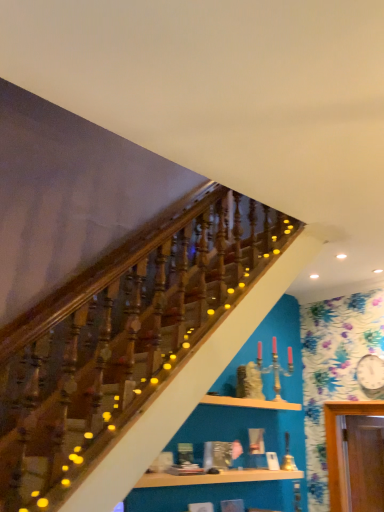
You are a GUI agent. You are given a task and a screenshot of the screen. Output one action in this format:
    pyautogui.click(x=<x>, y=<y>)
    Task: Click on the wooden shelf at lower center, which is the second shelf in top-to-bottom order
    
    Given the screenshot: What is the action you would take?
    pyautogui.click(x=215, y=477)

This screenshot has width=384, height=512. What do you see at coordinates (215, 477) in the screenshot?
I see `wooden shelf at lower center, which is the second shelf in top-to-bottom order` at bounding box center [215, 477].

The image size is (384, 512). What do you see at coordinates (250, 403) in the screenshot?
I see `wooden shelf at center, acting as the 2th shelf starting from the bottom` at bounding box center [250, 403].

You are a GUI agent. You are given a task and a screenshot of the screen. Output one action in this format:
    pyautogui.click(x=<x>, y=<y>)
    Task: Click on the wooden shelf at center, acting as the 2th shelf starting from the bottom
    Image resolution: width=384 pixels, height=512 pixels.
    Given the screenshot: What is the action you would take?
    pyautogui.click(x=250, y=403)

Based on the photo, in order to face wooden shelf at center, which ranks as the 1th shelf in top-to-bottom order, should I rotate leftwards or rightwards?

A 7.129 degree turn to the right will do.

Identify the location of wooden shelf at lower center, which is the second shelf in top-to-bottom order. (215, 477).

Looking at this image, which object is positioned more to the left, wooden shelf at center, acting as the 2th shelf starting from the bottom, or wooden shelf at lower center, which is the second shelf in top-to-bottom order?

From the viewer's perspective, wooden shelf at lower center, which is the second shelf in top-to-bottom order, appears more on the left side.

Based on the photo, in the image, is wooden shelf at center, which ranks as the 1th shelf in top-to-bottom order, positioned in front of or behind wooden shelf at lower center, acting as the 1th shelf starting from the bottom?

wooden shelf at center, which ranks as the 1th shelf in top-to-bottom order, is positioned farther from the viewer than wooden shelf at lower center, acting as the 1th shelf starting from the bottom.

Between point (281, 405) and point (170, 480), which one is positioned in front?

The point (170, 480) is closer.

From the image's perspective, is wooden shelf at center, acting as the 2th shelf starting from the bottom, located beneath wooden shelf at lower center, acting as the 1th shelf starting from the bottom?

Incorrect, from the image's perspective, wooden shelf at center, acting as the 2th shelf starting from the bottom, is higher than wooden shelf at lower center, acting as the 1th shelf starting from the bottom.

From a real-world perspective, is wooden shelf at center, acting as the 2th shelf starting from the bottom, physically above wooden shelf at lower center, acting as the 1th shelf starting from the bottom?

Yes, from a real-world perspective, wooden shelf at center, acting as the 2th shelf starting from the bottom, is over wooden shelf at lower center, acting as the 1th shelf starting from the bottom

Which object is wider, wooden shelf at center, which ranks as the 1th shelf in top-to-bottom order, or wooden shelf at lower center, which is the second shelf in top-to-bottom order?

Wider between the two is wooden shelf at center, which ranks as the 1th shelf in top-to-bottom order.

Between wooden shelf at center, acting as the 2th shelf starting from the bottom, and wooden shelf at lower center, acting as the 1th shelf starting from the bottom, which one has less height?

With less height is wooden shelf at lower center, acting as the 1th shelf starting from the bottom.

Looking at the image, does wooden shelf at center, which ranks as the 1th shelf in top-to-bottom order, seem bigger or smaller compared to wooden shelf at lower center, which is the second shelf in top-to-bottom order?

wooden shelf at center, which ranks as the 1th shelf in top-to-bottom order, is smaller than wooden shelf at lower center, which is the second shelf in top-to-bottom order.

Is wooden shelf at lower center, which is the second shelf in top-to-bottom order, inside wooden shelf at center, acting as the 2th shelf starting from the bottom?

No, wooden shelf at lower center, which is the second shelf in top-to-bottom order, is not surrounded by wooden shelf at center, acting as the 2th shelf starting from the bottom.

Are wooden shelf at center, acting as the 2th shelf starting from the bottom, and wooden shelf at lower center, which is the second shelf in top-to-bottom order, making contact?

No, wooden shelf at center, acting as the 2th shelf starting from the bottom, is not making contact with wooden shelf at lower center, which is the second shelf in top-to-bottom order.

Is wooden shelf at center, acting as the 2th shelf starting from the bottom, positioned with its back to wooden shelf at lower center, acting as the 1th shelf starting from the bottom?

That's not correct — wooden shelf at center, acting as the 2th shelf starting from the bottom, is not looking away from wooden shelf at lower center, acting as the 1th shelf starting from the bottom.

Where is `shelf that is on the right side of wooden shelf at lower center, acting as the 1th shelf starting from the bottom`? shelf that is on the right side of wooden shelf at lower center, acting as the 1th shelf starting from the bottom is located at coordinates (250, 403).

Considering the positions of objects wooden shelf at lower center, which is the second shelf in top-to-bottom order, and wooden shelf at center, which ranks as the 1th shelf in top-to-bottom order, in the image provided, who is more to the right, wooden shelf at lower center, which is the second shelf in top-to-bottom order, or wooden shelf at center, which ranks as the 1th shelf in top-to-bottom order,?

From the viewer's perspective, wooden shelf at center, which ranks as the 1th shelf in top-to-bottom order, appears more on the right side.

Does wooden shelf at lower center, acting as the 1th shelf starting from the bottom, come in front of wooden shelf at center, which ranks as the 1th shelf in top-to-bottom order?

Yes, it is in front of wooden shelf at center, which ranks as the 1th shelf in top-to-bottom order.

Is point (244, 479) positioned in front of point (254, 399)?

Yes, it is.

Based on the photo, from the image's perspective, which one is positioned higher, wooden shelf at lower center, which is the second shelf in top-to-bottom order, or wooden shelf at center, acting as the 2th shelf starting from the bottom?

From the image's view, wooden shelf at center, acting as the 2th shelf starting from the bottom, is above.

From a real-world perspective, is wooden shelf at lower center, which is the second shelf in top-to-bottom order, above or below wooden shelf at center, acting as the 2th shelf starting from the bottom?

wooden shelf at lower center, which is the second shelf in top-to-bottom order, is situated lower than wooden shelf at center, acting as the 2th shelf starting from the bottom, in the real world.

Considering the relative sizes of wooden shelf at lower center, which is the second shelf in top-to-bottom order, and wooden shelf at center, acting as the 2th shelf starting from the bottom, in the image provided, is wooden shelf at lower center, which is the second shelf in top-to-bottom order, wider than wooden shelf at center, acting as the 2th shelf starting from the bottom,?

No.

Between wooden shelf at lower center, acting as the 1th shelf starting from the bottom, and wooden shelf at center, which ranks as the 1th shelf in top-to-bottom order, which one has more height?

With more height is wooden shelf at center, which ranks as the 1th shelf in top-to-bottom order.

Between wooden shelf at lower center, which is the second shelf in top-to-bottom order, and wooden shelf at center, which ranks as the 1th shelf in top-to-bottom order, which one has larger size?

wooden shelf at lower center, which is the second shelf in top-to-bottom order, is bigger.

Is wooden shelf at lower center, which is the second shelf in top-to-bottom order, outside of wooden shelf at center, acting as the 2th shelf starting from the bottom?

That's correct, wooden shelf at lower center, which is the second shelf in top-to-bottom order, is outside of wooden shelf at center, acting as the 2th shelf starting from the bottom.

Is wooden shelf at lower center, which is the second shelf in top-to-bottom order, not near wooden shelf at center, which ranks as the 1th shelf in top-to-bottom order?

Actually, wooden shelf at lower center, which is the second shelf in top-to-bottom order, and wooden shelf at center, which ranks as the 1th shelf in top-to-bottom order, are a little close together.

Based on the photo, is wooden shelf at lower center, which is the second shelf in top-to-bottom order, oriented towards wooden shelf at center, which ranks as the 1th shelf in top-to-bottom order?

No.

Can you tell me how much wooden shelf at lower center, acting as the 1th shelf starting from the bottom, and wooden shelf at center, acting as the 2th shelf starting from the bottom, differ in facing direction?

0.001 degrees separate the facing orientations of wooden shelf at lower center, acting as the 1th shelf starting from the bottom, and wooden shelf at center, acting as the 2th shelf starting from the bottom.

Locate an element on the screen. This screenshot has width=384, height=512. shelf below the wooden shelf at center, acting as the 2th shelf starting from the bottom (from the image's perspective) is located at coordinates (215, 477).

Find the location of a particular element. shelf above the wooden shelf at lower center, which is the second shelf in top-to-bottom order (from the image's perspective) is located at coordinates (250, 403).

In the image, there is a wooden shelf at center, acting as the 2th shelf starting from the bottom. Find the location of `shelf below it (from a real-world perspective)`. shelf below it (from a real-world perspective) is located at coordinates (215, 477).